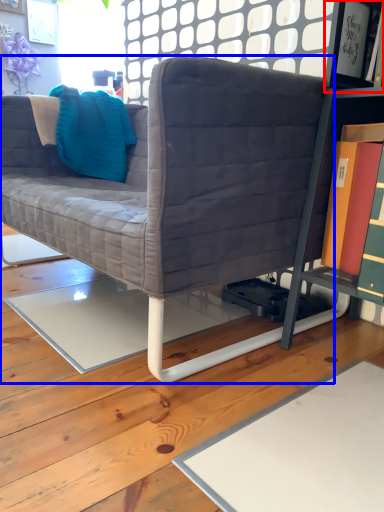
Question: Which object is further to the camera taking this photo, shelf (highlighted by a red box) or studio couch (highlighted by a blue box)?

Choices:
 (A) shelf
 (B) studio couch

Answer: (A)